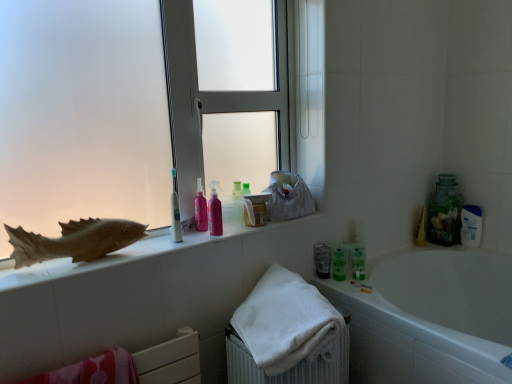
Find the location of a particular element. Image resolution: width=512 pixels, height=384 pixels. green matte tube at center, which appears as the first mouthwash when viewed from the back is located at coordinates (322, 260).

Identify the location of green translucent bottle at lower center, placed as the 2th toiletry when sorted from front to back. The width and height of the screenshot is (512, 384). (x=359, y=261).

Measure the distance between green translucent bottle at lower center, acting as the 1th toiletry starting from the back, and camera.

They are 5.51 feet apart.

Describe the element at coordinates (175, 212) in the screenshot. Image resolution: width=512 pixels, height=384 pixels. I see `white plastic toothbrush at center` at that location.

What do you see at coordinates (94, 371) in the screenshot? The image size is (512, 384). I see `white cotton towel at lower left` at bounding box center [94, 371].

What do you see at coordinates (200, 208) in the screenshot?
I see `pink glossy lotion at center, which appears as the first toiletry when viewed from the top` at bounding box center [200, 208].

Measure the distance between white glossy bathtub at lower right and camera.

The distance of white glossy bathtub at lower right from camera is 3.62 feet.

Locate an element on the screen. This screenshot has height=384, width=512. white textured towel at lower center is located at coordinates (293, 366).

You are a GUI agent. You are given a task and a screenshot of the screen. Output one action in this format:
    pyautogui.click(x=<x>, y=<y>)
    Task: Click on the green matte tube at center, which ranks as the second mouthwash in left-to-right order
    The width and height of the screenshot is (512, 384).
    Given the screenshot: What is the action you would take?
    pyautogui.click(x=322, y=260)

Between pink glossy mouthwash at center, placed as the 1th mouthwash when sorted from front to back, and brown matte fish at left, which one has more height?

pink glossy mouthwash at center, placed as the 1th mouthwash when sorted from front to back, is taller.

Considering the positions of objects pink glossy mouthwash at center, which is the 1th mouthwash from left to right, and brown matte fish at left in the image provided, who is more to the right, pink glossy mouthwash at center, which is the 1th mouthwash from left to right, or brown matte fish at left?

Positioned to the right is pink glossy mouthwash at center, which is the 1th mouthwash from left to right.

Could you tell me if pink glossy mouthwash at center, placed as the 1th mouthwash when sorted from front to back, is facing brown matte fish at left?

No, pink glossy mouthwash at center, placed as the 1th mouthwash when sorted from front to back, is not turned towards brown matte fish at left.

Consider the image. Which object is wider, white plastic toothbrush at center or brown matte fish at left?

With larger width is brown matte fish at left.

From a real-world perspective, is white plastic toothbrush at center above or below brown matte fish at left?

In terms of real-world spatial position, white plastic toothbrush at center is above brown matte fish at left.

Is point (177, 207) closer to camera compared to point (67, 234)?

No.

Is white plastic toothbrush at center inside or outside of brown matte fish at left?

white plastic toothbrush at center exists outside the volume of brown matte fish at left.

Considering the points (39, 382) and (209, 225), which point is behind, point (39, 382) or point (209, 225)?

The point (209, 225) is farther.

Which of these two, white cotton towel at lower left or pink glossy mouthwash at center, which is the 1th mouthwash from left to right, is bigger?

Bigger between the two is white cotton towel at lower left.

Visually, is white cotton towel at lower left positioned to the left or to the right of pink glossy mouthwash at center, placed as the 1th mouthwash when sorted from front to back?

In the image, white cotton towel at lower left appears on the left side of pink glossy mouthwash at center, placed as the 1th mouthwash when sorted from front to back.

How different are the orientations of white cotton towel at lower left and pink glossy mouthwash at center, placed as the 1th mouthwash when sorted from front to back, in degrees?

2 degrees.

Can green translucent bottle at lower center, placed as the 2th toiletry when sorted from front to back, be found inside green matte tube at center, acting as the 2th mouthwash starting from the right?

Actually, green translucent bottle at lower center, placed as the 2th toiletry when sorted from front to back, is outside green matte tube at center, acting as the 2th mouthwash starting from the right.

Considering the relative sizes of green matte tube at center, acting as the 2th mouthwash starting from the right, and green translucent bottle at lower center, placed as the first toiletry when sorted from right to left, in the image provided, is green matte tube at center, acting as the 2th mouthwash starting from the right, wider than green translucent bottle at lower center, placed as the first toiletry when sorted from right to left,?

No.

From the image's perspective, who appears lower, green matte tube at center, which ranks as the second mouthwash in left-to-right order, or green translucent bottle at lower center, placed as the 2th toiletry when sorted from front to back?

From the image's view, green matte tube at center, which ranks as the second mouthwash in left-to-right order, is below.

Considering the positions of point (318, 248) and point (355, 267), is point (318, 248) closer or farther from the camera than point (355, 267)?

Clearly, point (318, 248) is more distant from the camera than point (355, 267).

In the scene shown: Is there a large distance between white cotton towel at lower left and green translucent bottle at lower center, which is the 2th toiletry from top to bottom?

No, there isn't a large distance between white cotton towel at lower left and green translucent bottle at lower center, which is the 2th toiletry from top to bottom.

Which is more to the right, white cotton towel at lower left or green translucent bottle at lower center, acting as the 1th toiletry starting from the back?

From the viewer's perspective, green translucent bottle at lower center, acting as the 1th toiletry starting from the back, appears more on the right side.

From the image's perspective, is white cotton towel at lower left on green translucent bottle at lower center, acting as the 1th toiletry starting from the back?

Incorrect, from the image's perspective, white cotton towel at lower left is lower than green translucent bottle at lower center, acting as the 1th toiletry starting from the back.

Can you confirm if white cotton towel at lower left is thinner than green translucent bottle at lower center, acting as the 1th toiletry starting from the back?

Incorrect, the width of white cotton towel at lower left is not less than that of green translucent bottle at lower center, acting as the 1th toiletry starting from the back.

How many degrees apart are the facing directions of matte plastic fish at left and white textured towel at lower center?

They differ by 0.529 degrees in their facing directions.

Between matte plastic fish at left and white textured towel at lower center, which one has less height?

Standing shorter between the two is matte plastic fish at left.

Which is in front, point (151, 241) or point (314, 367)?

The point (314, 367) is closer to the camera.

Can white textured towel at lower center be found inside matte plastic fish at left?

No, white textured towel at lower center is not inside matte plastic fish at left.

Considering the sizes of objects white glossy bathtub at lower right and brown matte fish at left in the image provided, who is taller, white glossy bathtub at lower right or brown matte fish at left?

white glossy bathtub at lower right.

From a real-world perspective, is white glossy bathtub at lower right physically located above or below brown matte fish at left?

In terms of real-world spatial position, white glossy bathtub at lower right is below brown matte fish at left.

Is white glossy bathtub at lower right positioned far away from brown matte fish at left?

Yes.

Does point (369, 337) come behind point (98, 237)?

Yes, it is.

The width and height of the screenshot is (512, 384). In the image, there is a brown matte fish at left. What are the coordinates of `mouthwash above it (from the image's perspective)` in the screenshot? It's located at (215, 211).

Image resolution: width=512 pixels, height=384 pixels. What are the coordinates of `fish beneath the white plastic toothbrush at center (from a real-world perspective)` in the screenshot? It's located at pos(74,241).

Based on their spatial positions, is green matte tube at center, which ranks as the second mouthwash in left-to-right order, or pink glossy lotion at center, the 1th toiletry when ordered from left to right, closer to green matte mouthwash at lower right, marked as the 2th mouthwash in a front-to-back arrangement?

Based on the image, green matte tube at center, which ranks as the second mouthwash in left-to-right order, appears to be nearer to green matte mouthwash at lower right, marked as the 2th mouthwash in a front-to-back arrangement.

Estimate the real-world distances between objects in this image. Which object is closer to green matte tube at center, acting as the 2th mouthwash starting from the right, white cotton towel at lower left or green matte mouthwash at lower right, marked as the 3th mouthwash in a left-to-right arrangement?

The object closer to green matte tube at center, acting as the 2th mouthwash starting from the right, is green matte mouthwash at lower right, marked as the 3th mouthwash in a left-to-right arrangement.

In the scene shown: Looking at the image, which one is located further to pink glossy lotion at center, which appears as the first toiletry when viewed from the top, clear glass jar at upper right or white textured towel at lower center?

clear glass jar at upper right.

Looking at the image, which one is located further to white cotton towel at lower left, white textured towel at lower center or green matte mouthwash at lower right, marked as the 2th mouthwash in a front-to-back arrangement?

green matte mouthwash at lower right, marked as the 2th mouthwash in a front-to-back arrangement, is further to white cotton towel at lower left.

When comparing their distances from frosted glass window at upper center, does green matte mouthwash at lower right, marked as the 2th mouthwash in a front-to-back arrangement, or green matte tube at center, acting as the 2th mouthwash starting from the right, seem closer?

Based on the image, green matte tube at center, acting as the 2th mouthwash starting from the right, appears to be nearer to frosted glass window at upper center.

Estimate the real-world distances between objects in this image. Which object is closer to green translucent bottle at lower center, placed as the first toiletry when sorted from right to left, clear glass jar at upper right or pink glossy lotion at center, arranged as the first toiletry when viewed from the front?

clear glass jar at upper right.

Considering their positions, is brown matte fish at left positioned closer to white plastic toothbrush at center than green matte mouthwash at lower right, marked as the 2th mouthwash in a front-to-back arrangement?

brown matte fish at left is closer to white plastic toothbrush at center.

Which object lies further to the anchor point green translucent bottle at lower center, placed as the first toiletry when sorted from right to left, green matte mouthwash at lower right, marked as the 3th mouthwash in a left-to-right arrangement, or white plastic toothbrush at center?

white plastic toothbrush at center is positioned further to the anchor green translucent bottle at lower center, placed as the first toiletry when sorted from right to left.

The height and width of the screenshot is (384, 512). What are the coordinates of `toiletry located between brown matte fish at left and green translucent bottle at lower center, which is the 2th toiletry from top to bottom, in the left-right direction` in the screenshot? It's located at (200, 208).

Identify the location of bottle between matte plastic fish at left and pink glossy mouthwash at center, placed as the 1th mouthwash when sorted from front to back, along the z-axis. (175, 212).

Identify the location of bathtub between white plastic toothbrush at center and clear glass jar at upper right. The image size is (512, 384). tap(430, 318).

The height and width of the screenshot is (384, 512). In order to click on counter top between frosted glass window at upper center and white textured towel at lower center in the up-down direction in this screenshot , I will do `click(133, 254)`.